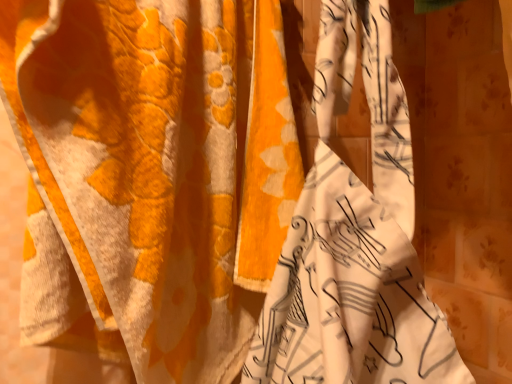
Describe the element at coordinates (354, 239) in the screenshot. I see `floral fabric curtain at center, which is the first curtain from right to left` at that location.

Find the location of a particular element. floral fabric curtain at center, which is the first curtain from right to left is located at coordinates (354, 239).

What do you see at coordinates (151, 175) in the screenshot?
I see `orange fabric curtain at center, acting as the first curtain starting from the left` at bounding box center [151, 175].

At what (x,y) coordinates should I click in order to perform the action: click on orange fabric curtain at center, acting as the first curtain starting from the left. Please return your answer as a coordinate pair (x, y). This screenshot has width=512, height=384. Looking at the image, I should click on (151, 175).

The height and width of the screenshot is (384, 512). I want to click on floral fabric curtain at center, which is the first curtain from right to left, so click(354, 239).

Is floral fabric curtain at center, which is the first curtain from right to left, at the left side of orange fabric curtain at center, placed as the second curtain when sorted from right to left?

In fact, floral fabric curtain at center, which is the first curtain from right to left, is to the right of orange fabric curtain at center, placed as the second curtain when sorted from right to left.

Does floral fabric curtain at center, which is the 2th curtain from left to right, come behind orange fabric curtain at center, acting as the first curtain starting from the left?

No.

In the scene shown: Which is more distant, [274,329] or [169,199]?

Point [169,199]

From the image's perspective, relative to orange fabric curtain at center, acting as the first curtain starting from the left, is floral fabric curtain at center, which is the 2th curtain from left to right, above or below?

floral fabric curtain at center, which is the 2th curtain from left to right, is below orange fabric curtain at center, acting as the first curtain starting from the left.

Consider the image. From a real-world perspective, which is physically below, floral fabric curtain at center, which is the first curtain from right to left, or orange fabric curtain at center, placed as the second curtain when sorted from right to left?

floral fabric curtain at center, which is the first curtain from right to left.

Can you confirm if floral fabric curtain at center, which is the first curtain from right to left, is thinner than orange fabric curtain at center, acting as the first curtain starting from the left?

No, floral fabric curtain at center, which is the first curtain from right to left, is not thinner than orange fabric curtain at center, acting as the first curtain starting from the left.

From the picture: Considering the sizes of floral fabric curtain at center, which is the 2th curtain from left to right, and orange fabric curtain at center, placed as the second curtain when sorted from right to left, in the image, is floral fabric curtain at center, which is the 2th curtain from left to right, taller or shorter than orange fabric curtain at center, placed as the second curtain when sorted from right to left,?

floral fabric curtain at center, which is the 2th curtain from left to right, is shorter than orange fabric curtain at center, placed as the second curtain when sorted from right to left.

Which of these two, floral fabric curtain at center, which is the first curtain from right to left, or orange fabric curtain at center, acting as the first curtain starting from the left, is smaller?

floral fabric curtain at center, which is the first curtain from right to left, is smaller.

Could orange fabric curtain at center, acting as the first curtain starting from the left, be considered to be inside floral fabric curtain at center, which is the first curtain from right to left?

No, orange fabric curtain at center, acting as the first curtain starting from the left, is not a part of floral fabric curtain at center, which is the first curtain from right to left.

Is floral fabric curtain at center, which is the 2th curtain from left to right, touching orange fabric curtain at center, acting as the first curtain starting from the left?

No, floral fabric curtain at center, which is the 2th curtain from left to right, is not making contact with orange fabric curtain at center, acting as the first curtain starting from the left.

Is floral fabric curtain at center, which is the first curtain from right to left, positioned with its back to orange fabric curtain at center, acting as the first curtain starting from the left?

No, floral fabric curtain at center, which is the first curtain from right to left, is not facing away from orange fabric curtain at center, acting as the first curtain starting from the left.

What's the angular difference between floral fabric curtain at center, which is the 2th curtain from left to right, and orange fabric curtain at center, acting as the first curtain starting from the left,'s facing directions?

96.3 degrees.

How distant is floral fabric curtain at center, which is the 2th curtain from left to right, from orange fabric curtain at center, acting as the first curtain starting from the left?

floral fabric curtain at center, which is the 2th curtain from left to right, and orange fabric curtain at center, acting as the first curtain starting from the left, are 6.81 inches apart.

Locate an element on the screen. curtain on the left of floral fabric curtain at center, which is the 2th curtain from left to right is located at coordinates (151, 175).

Which is more to the left, orange fabric curtain at center, acting as the first curtain starting from the left, or floral fabric curtain at center, which is the 2th curtain from left to right?

Positioned to the left is orange fabric curtain at center, acting as the first curtain starting from the left.

Is orange fabric curtain at center, acting as the first curtain starting from the left, in front of or behind floral fabric curtain at center, which is the first curtain from right to left, in the image?

Visually, orange fabric curtain at center, acting as the first curtain starting from the left, is located behind floral fabric curtain at center, which is the first curtain from right to left.

Which point is more distant from viewer, (50, 14) or (450, 352)?

The point (450, 352) is farther from the camera.

From the image's perspective, is orange fabric curtain at center, placed as the second curtain when sorted from right to left, located above or below floral fabric curtain at center, which is the first curtain from right to left?

From the image's perspective, orange fabric curtain at center, placed as the second curtain when sorted from right to left, appears above floral fabric curtain at center, which is the first curtain from right to left.

From a real-world perspective, is orange fabric curtain at center, placed as the second curtain when sorted from right to left, positioned over floral fabric curtain at center, which is the first curtain from right to left, based on gravity?

Yes.

Which of these two, orange fabric curtain at center, acting as the first curtain starting from the left, or floral fabric curtain at center, which is the first curtain from right to left, is wider?

floral fabric curtain at center, which is the first curtain from right to left, is wider.

Who is shorter, orange fabric curtain at center, placed as the second curtain when sorted from right to left, or floral fabric curtain at center, which is the 2th curtain from left to right?

With less height is floral fabric curtain at center, which is the 2th curtain from left to right.

Considering the sizes of orange fabric curtain at center, acting as the first curtain starting from the left, and floral fabric curtain at center, which is the 2th curtain from left to right, in the image, is orange fabric curtain at center, acting as the first curtain starting from the left, bigger or smaller than floral fabric curtain at center, which is the 2th curtain from left to right,?

Considering their sizes, orange fabric curtain at center, acting as the first curtain starting from the left, takes up more space than floral fabric curtain at center, which is the 2th curtain from left to right.

Could floral fabric curtain at center, which is the first curtain from right to left, be considered to be inside orange fabric curtain at center, placed as the second curtain when sorted from right to left?

No.

Is orange fabric curtain at center, placed as the second curtain when sorted from right to left, positioned far away from floral fabric curtain at center, which is the 2th curtain from left to right?

orange fabric curtain at center, placed as the second curtain when sorted from right to left, is near floral fabric curtain at center, which is the 2th curtain from left to right, not far away.

Could you tell me if orange fabric curtain at center, placed as the second curtain when sorted from right to left, is turned towards floral fabric curtain at center, which is the 2th curtain from left to right?

Yes, orange fabric curtain at center, placed as the second curtain when sorted from right to left, is facing floral fabric curtain at center, which is the 2th curtain from left to right.

This screenshot has width=512, height=384. In the image, there is a floral fabric curtain at center, which is the 2th curtain from left to right. What are the coordinates of `curtain above it (from the image's perspective)` in the screenshot? It's located at (151, 175).

This screenshot has height=384, width=512. What are the coordinates of `curtain above the floral fabric curtain at center, which is the first curtain from right to left (from the image's perspective)` in the screenshot? It's located at (151, 175).

This screenshot has height=384, width=512. I want to click on curtain in front of the orange fabric curtain at center, acting as the first curtain starting from the left, so click(x=354, y=239).